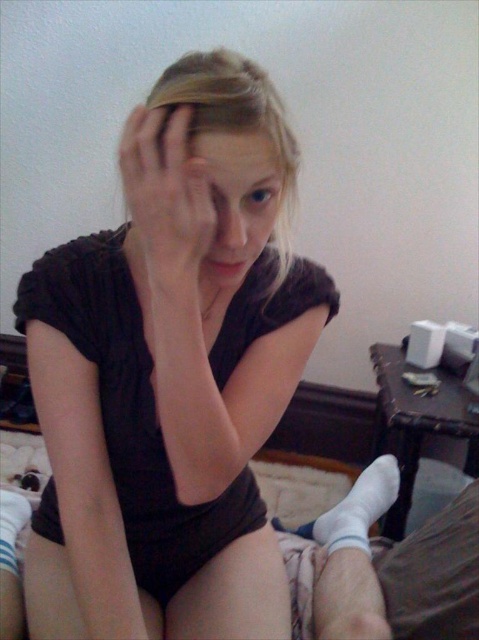
Question: Among these objects, which one is farthest from the camera?

Choices:
 (A) matte black shirt at center
 (B) matte black hand at upper center
 (C) blonde hair at center
 (D) smooth skin at center

Answer: (D)

Question: Can you confirm if matte black hand at upper center is thinner than blonde hair at center?

Choices:
 (A) yes
 (B) no

Answer: (A)

Question: Which object is positioned farthest from the blonde hair at center?

Choices:
 (A) matte black shirt at center
 (B) smooth skin at center

Answer: (A)

Question: Which is farther from the matte skin face at center?

Choices:
 (A) blonde hair at center
 (B) matte black shirt at center
 (C) matte black hand at upper center
 (D) smooth skin at center

Answer: (B)

Question: In this image, where is matte black hand at upper center located relative to smooth skin at center?

Choices:
 (A) above
 (B) below

Answer: (B)

Question: Can you confirm if matte black shirt at center is thinner than smooth skin at center?

Choices:
 (A) no
 (B) yes

Answer: (A)